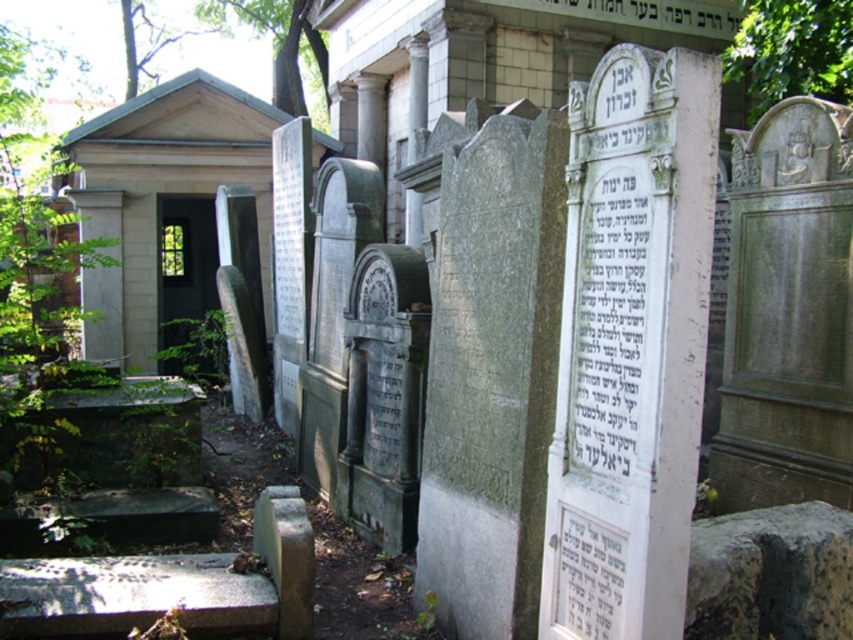
Question: Which point is closer to the camera?

Choices:
 (A) (759, 124)
 (B) (599, 454)

Answer: (B)

Question: Which point is farther to the camera?

Choices:
 (A) (90, 232)
 (B) (596, 580)

Answer: (A)

Question: Is black stone inscription at center closer to camera compared to white paper at center?

Choices:
 (A) no
 (B) yes

Answer: (B)

Question: Can you confirm if gray stone gravestone at center is positioned below black stone inscription at center?

Choices:
 (A) yes
 (B) no

Answer: (A)

Question: Does white stone gravestone at center have a greater width compared to white paper at center?

Choices:
 (A) yes
 (B) no

Answer: (A)

Question: Which point appears farthest from the camera in this image?

Choices:
 (A) (584, 298)
 (B) (711, 460)
 (C) (604, 544)
 (D) (502, 112)

Answer: (B)